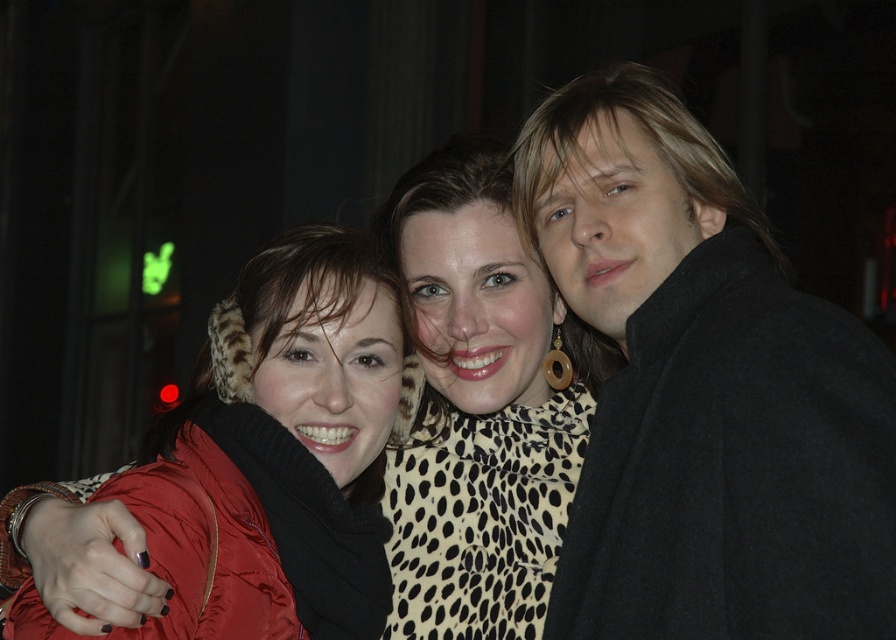
Who is positioned more to the right, black wool coat at right or leopard print scarf at center?

black wool coat at right is more to the right.

Is black wool coat at right to the left of leopard print scarf at center from the viewer's perspective?

Incorrect, black wool coat at right is not on the left side of leopard print scarf at center.

Does point (619, 109) come closer to viewer compared to point (412, 212)?

That is True.

Where is `black wool coat at right`? black wool coat at right is located at coordinates (704, 390).

Does black wool coat at right appear on the left side of matte red jacket at left?

No, black wool coat at right is not to the left of matte red jacket at left.

Can you confirm if black wool coat at right is taller than matte red jacket at left?

Yes.

Who is more distant from viewer, (768, 609) or (257, 394)?

The point (257, 394) is behind.

This screenshot has height=640, width=896. Identify the location of black wool coat at right. (704, 390).

Is leopard print scarf at center further to the viewer compared to matte red jacket at left?

Yes, it is behind matte red jacket at left.

Which is above, leopard print scarf at center or matte red jacket at left?

Positioned higher is leopard print scarf at center.

Which is in front, point (533, 589) or point (378, 276)?

Positioned in front is point (378, 276).

You are a GUI agent. You are given a task and a screenshot of the screen. Output one action in this format:
    pyautogui.click(x=<x>, y=<y>)
    Task: Click on the leopard print scarf at center
    
    Given the screenshot: What is the action you would take?
    click(481, 406)